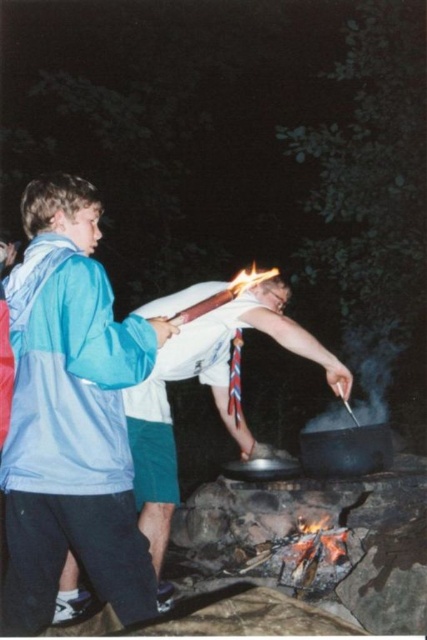
From the picture: Between blue fabric jacket at left and white fabric shirt at center, which one has less height?

blue fabric jacket at left

Who is more distant from viewer, (53,400) or (216,337)?

Positioned behind is point (216,337).

Describe the element at coordinates (70, 416) in the screenshot. The width and height of the screenshot is (427, 640). I see `blue fabric jacket at left` at that location.

Image resolution: width=427 pixels, height=640 pixels. In order to click on blue fabric jacket at left in this screenshot , I will do `click(70, 416)`.